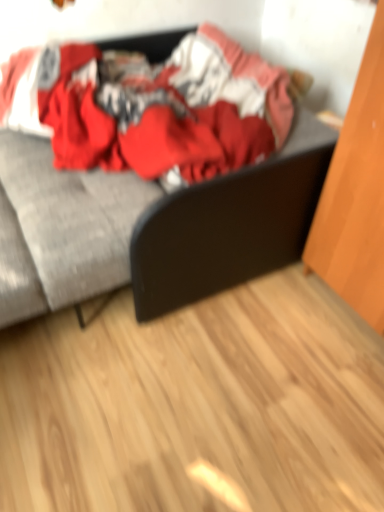
The width and height of the screenshot is (384, 512). Describe the element at coordinates (158, 227) in the screenshot. I see `textured gray couch at upper left` at that location.

Where is `textured gray couch at upper left`? textured gray couch at upper left is located at coordinates (158, 227).

Identify the location of textured gray couch at upper left. (158, 227).